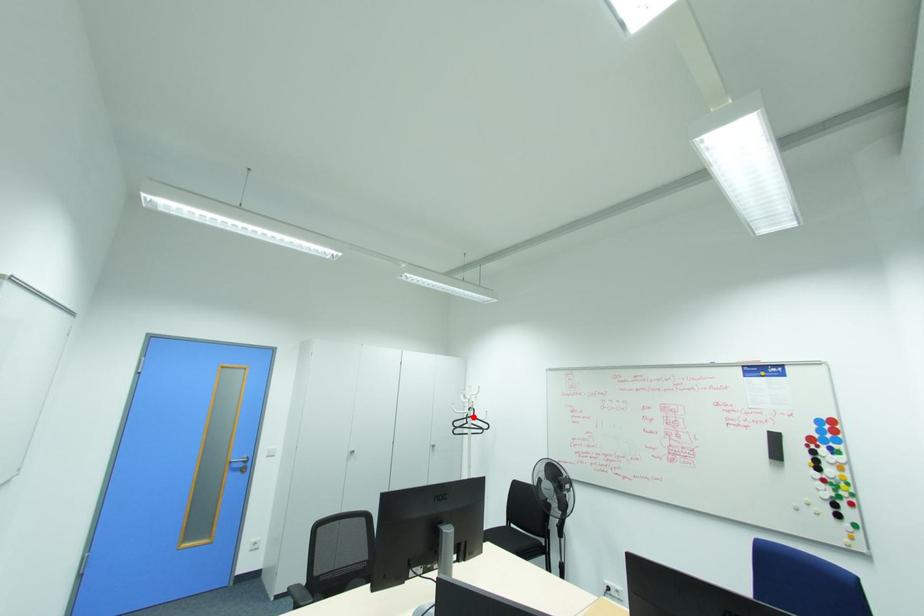
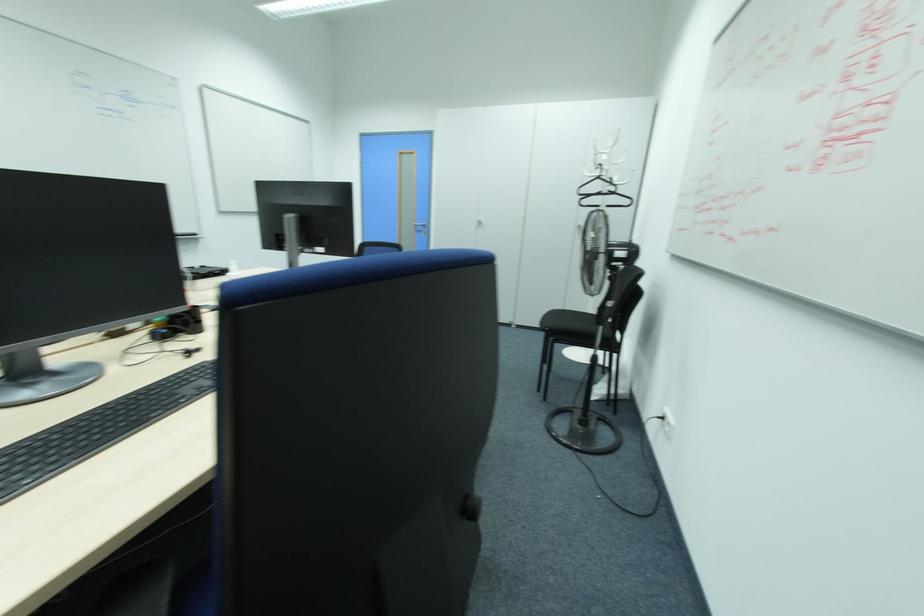
Question: I am providing you with two images of the same scene from different viewpoints. A red point is marked on the first image. Can you still see the location of the red point in image 2?

Choices:
 (A) Yes
 (B) No

Answer: (A)